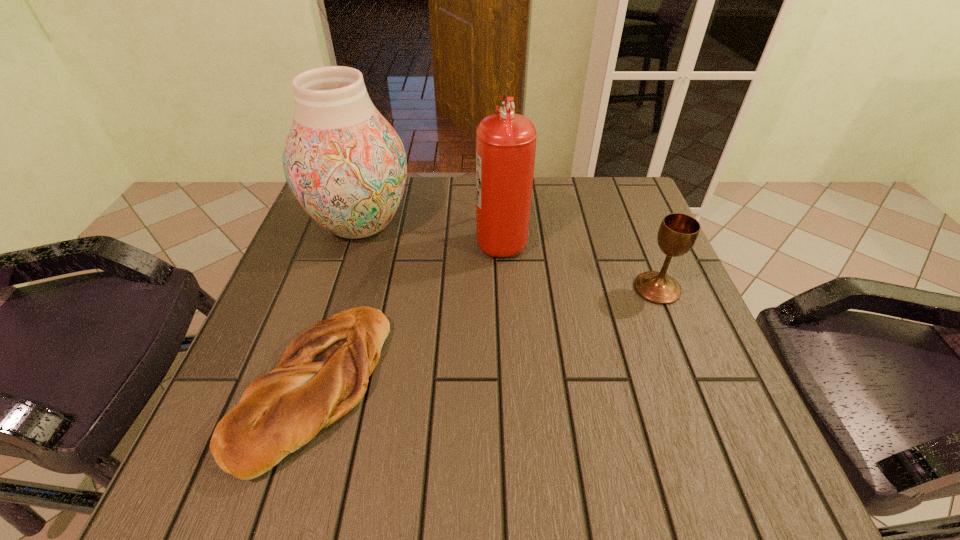
I want to click on the second object from right to left, so click(505, 142).

I want to click on vase, so click(345, 164).

What are the coordinates of `the rightmost object` in the screenshot? It's located at (678, 233).

Where is `chalice`? This screenshot has height=540, width=960. chalice is located at coordinates (678, 233).

Locate an element on the screen. This screenshot has height=540, width=960. the nearest object is located at coordinates (323, 374).

Locate an element on the screen. This screenshot has height=540, width=960. bread is located at coordinates (323, 374).

This screenshot has height=540, width=960. Identify the location of vacant region located on the instruction side of the third object from left to right. (440, 238).

The width and height of the screenshot is (960, 540). I want to click on free space located on the instruction side of the third object from left to right, so click(419, 238).

Where is `vacant space located 0.060m on the instruction side of the third object from left to right`? The width and height of the screenshot is (960, 540). vacant space located 0.060m on the instruction side of the third object from left to right is located at coordinates (451, 238).

Where is `free spot located on the front of the vase`? The height and width of the screenshot is (540, 960). free spot located on the front of the vase is located at coordinates (315, 365).